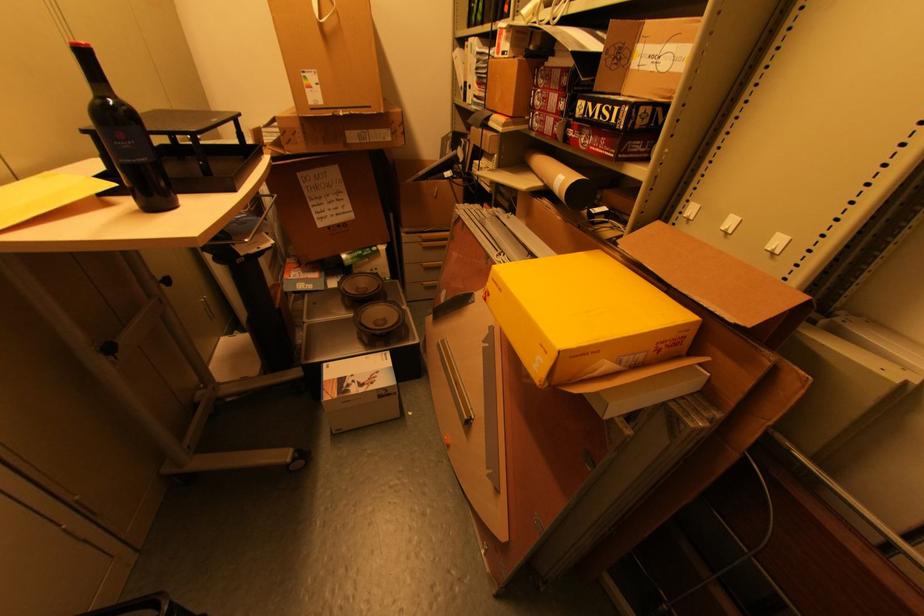
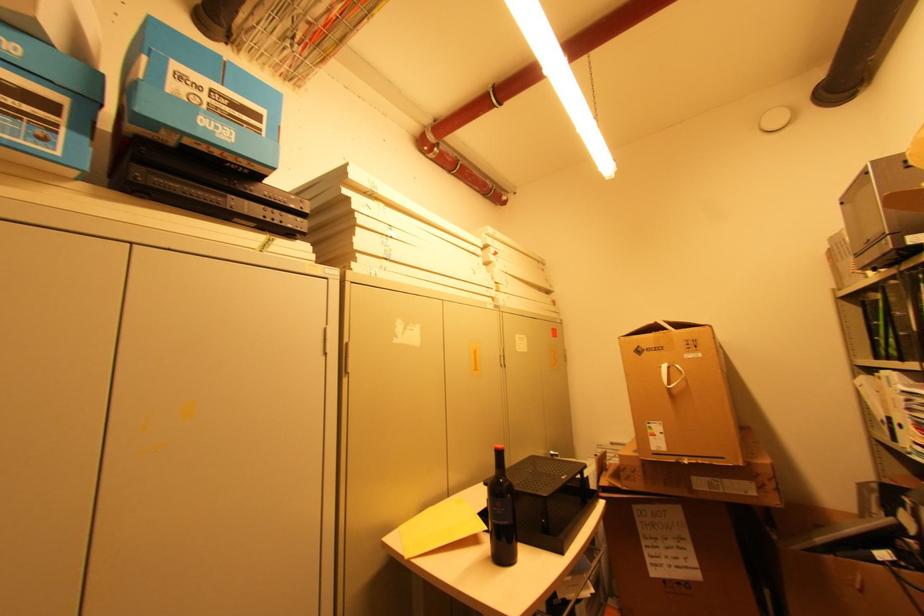
In the second image, find the point that corresponds to the point at 140,212 in the first image.

(492, 559)